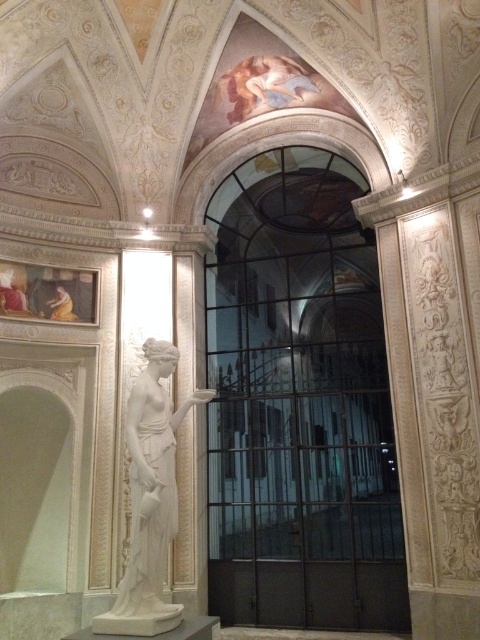
Question: Is metallic gate at center to the right of white marble statue at center from the viewer's perspective?

Choices:
 (A) no
 (B) yes

Answer: (B)

Question: Which point is closer to the camera?

Choices:
 (A) white marble statue at center
 (B) metallic gate at center

Answer: (A)

Question: Is metallic gate at center to the right of white marble statue at center from the viewer's perspective?

Choices:
 (A) yes
 (B) no

Answer: (A)

Question: Which point is closer to the camera?

Choices:
 (A) white marble statue at center
 (B) metallic gate at center

Answer: (A)

Question: Is metallic gate at center smaller than white marble statue at center?

Choices:
 (A) no
 (B) yes

Answer: (B)